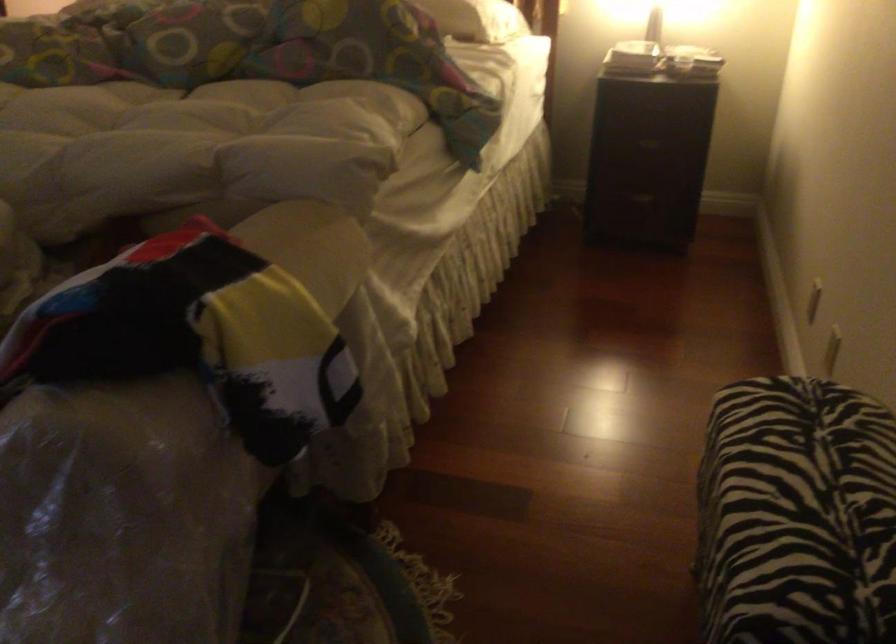
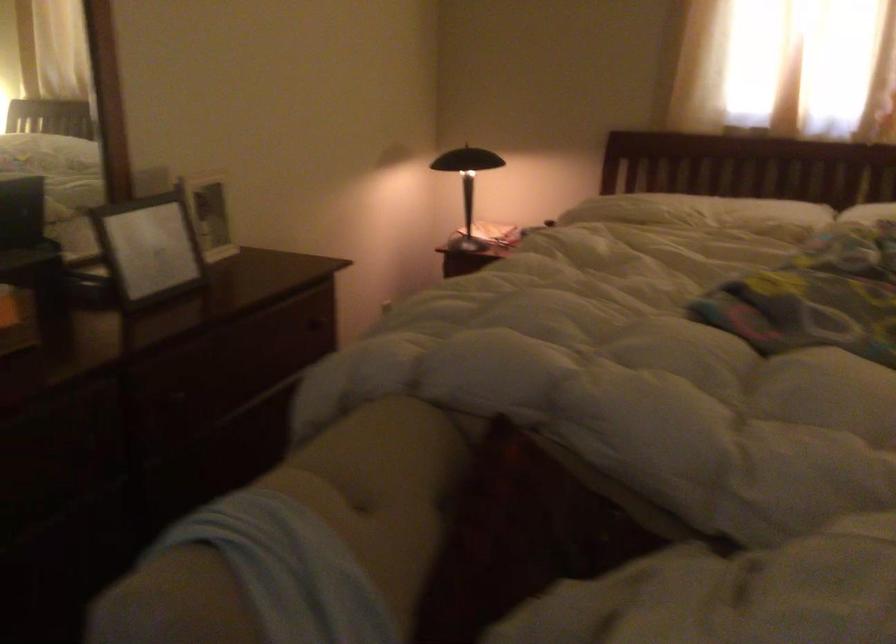
Question: In a continuous first-person perspective shot, in which direction is the camera moving?

Choices:
 (A) Left
 (B) Right
 (C) Forward
 (D) Backward

Answer: (A)